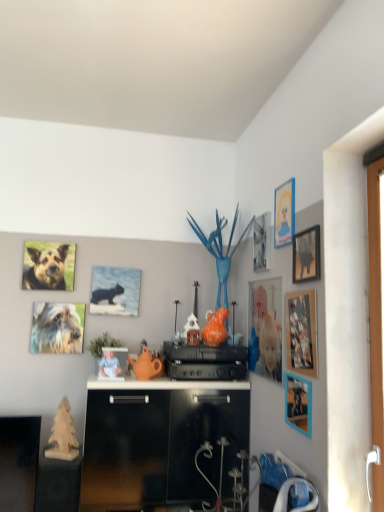
Question: Is white plastic handle at right at the back of wooden photo frame at right, positioned as the second picture frame in right-to-left order?

Choices:
 (A) yes
 (B) no

Answer: (B)

Question: From a real-world perspective, is wooden photo frame at right, arranged as the 7th picture frame when viewed from the left, on white plastic handle at right?

Choices:
 (A) yes
 (B) no

Answer: (B)

Question: Is wooden photo frame at right, positioned as the second picture frame in right-to-left order, wider than white plastic handle at right?

Choices:
 (A) yes
 (B) no

Answer: (B)

Question: Does wooden photo frame at right, positioned as the second picture frame in right-to-left order, have a lesser width compared to white plastic handle at right?

Choices:
 (A) yes
 (B) no

Answer: (A)

Question: Is there a large distance between wooden photo frame at right, positioned as the second picture frame in right-to-left order, and white plastic handle at right?

Choices:
 (A) no
 (B) yes

Answer: (A)

Question: Is wooden picture frame at upper right, arranged as the 1th picture frame when viewed from the right, wider or thinner than matte plastic picture frame at center, which is the 7th picture frame from right to left?

Choices:
 (A) wide
 (B) thin

Answer: (B)

Question: Based on their sizes in the image, would you say wooden picture frame at upper right, which is the eighth picture frame in left-to-right order, is bigger or smaller than matte plastic picture frame at center, which is the 7th picture frame from right to left?

Choices:
 (A) big
 (B) small

Answer: (B)

Question: Does point (292, 246) appear closer or farther from the camera than point (104, 355)?

Choices:
 (A) closer
 (B) farther

Answer: (A)

Question: Considering the positions of wooden picture frame at upper right, arranged as the 1th picture frame when viewed from the right, and matte plastic picture frame at center, which is the 7th picture frame from right to left, in the image, is wooden picture frame at upper right, arranged as the 1th picture frame when viewed from the right, taller or shorter than matte plastic picture frame at center, which is the 7th picture frame from right to left,?

Choices:
 (A) short
 (B) tall

Answer: (B)

Question: Looking at their shapes, would you say matte plastic picture frame at center, which is the 7th picture frame from right to left, is wider or thinner than matte plastic picture frame at upper right, acting as the fifth picture frame starting from the left?

Choices:
 (A) wide
 (B) thin

Answer: (A)

Question: Would you say matte plastic picture frame at center, arranged as the second picture frame when viewed from the left, is inside or outside matte plastic picture frame at upper right, acting as the fifth picture frame starting from the left?

Choices:
 (A) outside
 (B) inside

Answer: (A)

Question: Does point (125, 370) appear closer or farther from the camera than point (281, 204)?

Choices:
 (A) farther
 (B) closer

Answer: (A)

Question: Is matte plastic picture frame at center, arranged as the second picture frame when viewed from the left, to the left or to the right of matte plastic picture frame at upper right, acting as the fifth picture frame starting from the left, in the image?

Choices:
 (A) left
 (B) right

Answer: (A)

Question: Is matte blue cat at upper center, which is counted as the 8th picture frame, starting from the right, wider or thinner than matte plastic picture frame at center, arranged as the second picture frame when viewed from the left?

Choices:
 (A) wide
 (B) thin

Answer: (B)

Question: Considering the positions of matte blue cat at upper center, which is counted as the 8th picture frame, starting from the right, and matte plastic picture frame at center, which is the 7th picture frame from right to left, in the image, is matte blue cat at upper center, which is counted as the 8th picture frame, starting from the right, bigger or smaller than matte plastic picture frame at center, which is the 7th picture frame from right to left,?

Choices:
 (A) big
 (B) small

Answer: (A)